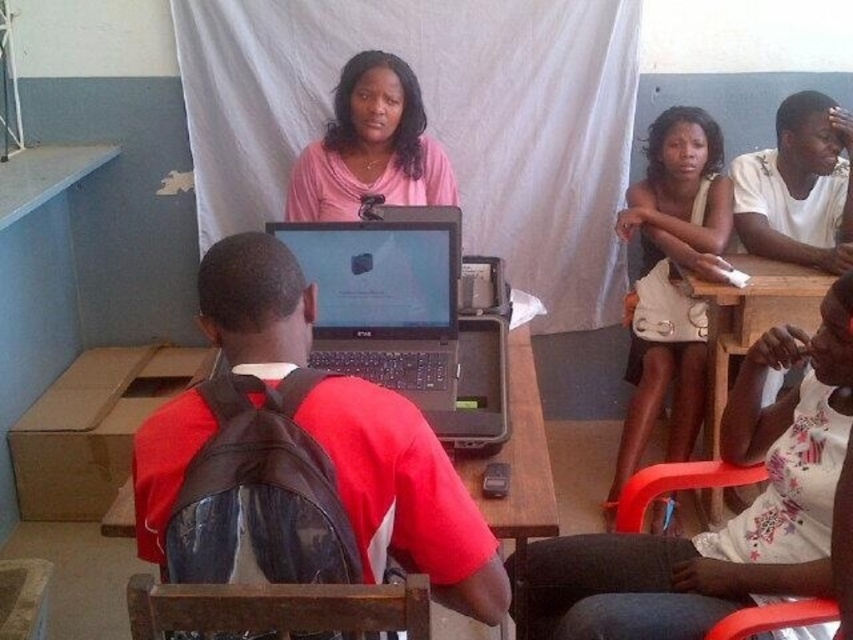
Question: Which point is closer to the camera?

Choices:
 (A) black matte laptop at center
 (B) black plastic laptop at center
 (C) pink matte shirt at center
 (D) wooden table at center

Answer: (A)

Question: Which point appears closest to the camera in this image?

Choices:
 (A) (178, 628)
 (B) (839, 465)
 (C) (807, 602)
 (D) (410, 160)

Answer: (A)

Question: Considering the relative positions of black plastic laptop at center and pink matte shirt at center in the image provided, where is black plastic laptop at center located with respect to pink matte shirt at center?

Choices:
 (A) left
 (B) right

Answer: (B)

Question: Is black matte laptop at center positioned at the back of floral fabric shirt at right?

Choices:
 (A) yes
 (B) no

Answer: (B)

Question: Is black plastic laptop at center thinner than white matte shirt at upper right?

Choices:
 (A) no
 (B) yes

Answer: (A)

Question: Which point is farther from the camera taking this photo?

Choices:
 (A) (817, 177)
 (B) (732, 442)
 (C) (199, 426)

Answer: (A)